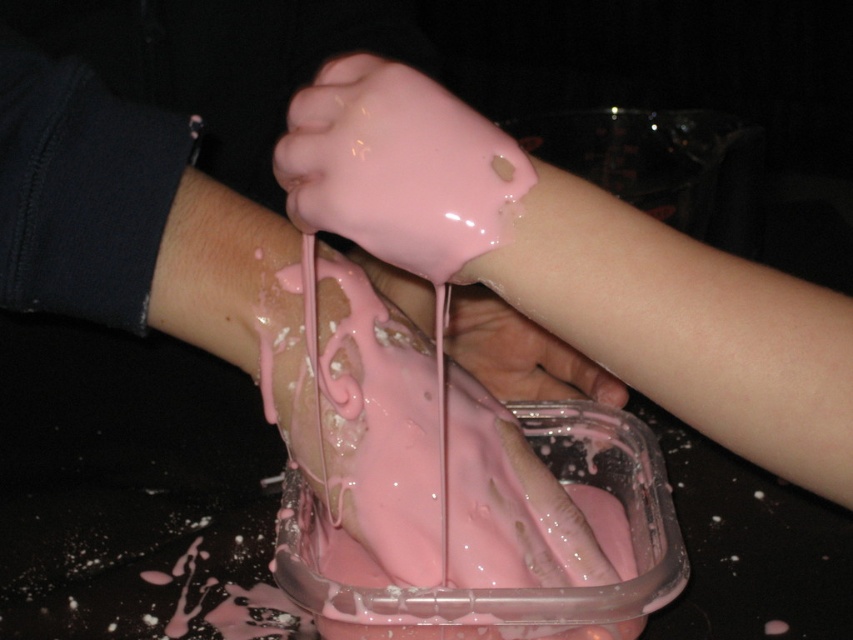
Between pink glossy frosting at center and pink glossy hand at center, which one is positioned higher?

pink glossy hand at center

Which is behind, point (469, 442) or point (367, 266)?

Positioned behind is point (367, 266).

Identify the location of pink glossy frosting at center. (386, 436).